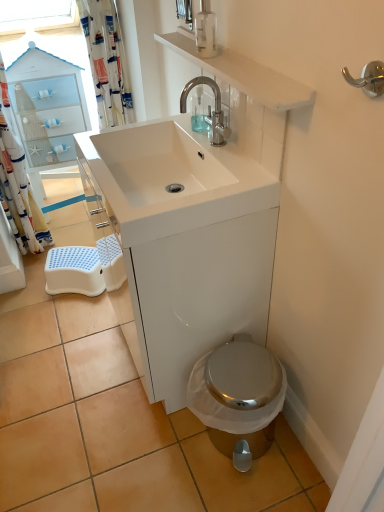
Question: Is there a large distance between transparent plastic soap dispenser at center, the second soap dispenser viewed from the front, and white fabric shower curtain at left, the 2th shower curtain viewed from the right?

Choices:
 (A) no
 (B) yes

Answer: (B)

Question: Does transparent plastic soap dispenser at center, the second soap dispenser viewed from the front, have a greater height compared to white fabric shower curtain at left, the 2th shower curtain viewed from the right?

Choices:
 (A) yes
 (B) no

Answer: (B)

Question: Is white fabric shower curtain at left, which is counted as the 1th shower curtain, starting from the left, located within transparent plastic soap dispenser at center, the first soap dispenser when ordered from back to front?

Choices:
 (A) no
 (B) yes

Answer: (A)

Question: Considering the relative sizes of transparent plastic soap dispenser at center, placed as the 2th soap dispenser when sorted from top to bottom, and white fabric shower curtain at left, which is counted as the 1th shower curtain, starting from the left, in the image provided, is transparent plastic soap dispenser at center, placed as the 2th soap dispenser when sorted from top to bottom, wider than white fabric shower curtain at left, which is counted as the 1th shower curtain, starting from the left,?

Choices:
 (A) yes
 (B) no

Answer: (B)

Question: Does transparent plastic soap dispenser at center, placed as the 2th soap dispenser when sorted from top to bottom, appear on the right side of white fabric shower curtain at left, the 2th shower curtain viewed from the right?

Choices:
 (A) yes
 (B) no

Answer: (A)

Question: Is point (203, 40) positioned closer to the camera than point (26, 220)?

Choices:
 (A) closer
 (B) farther

Answer: (A)

Question: In terms of width, does clear glass soap dispenser at upper center, the 1th soap dispenser in the top-to-bottom sequence, look wider or thinner when compared to white fabric shower curtain at left, which is counted as the 1th shower curtain, starting from the left?

Choices:
 (A) wide
 (B) thin

Answer: (B)

Question: Considering the positions of clear glass soap dispenser at upper center, the first soap dispenser from the front, and white fabric shower curtain at left, the 2th shower curtain viewed from the right, in the image, is clear glass soap dispenser at upper center, the first soap dispenser from the front, taller or shorter than white fabric shower curtain at left, the 2th shower curtain viewed from the right,?

Choices:
 (A) short
 (B) tall

Answer: (A)

Question: From a real-world perspective, is clear glass soap dispenser at upper center, the first soap dispenser from the front, above or below white fabric shower curtain at left, the 2th shower curtain viewed from the right?

Choices:
 (A) below
 (B) above

Answer: (B)

Question: Would you say white fabric shower curtain at upper left, the 1th shower curtain positioned from the right, is to the left or to the right of white glossy sink at center in the picture?

Choices:
 (A) left
 (B) right

Answer: (A)

Question: From the image's perspective, is white fabric shower curtain at upper left, arranged as the 2th shower curtain when viewed from the left, positioned above or below white glossy sink at center?

Choices:
 (A) below
 (B) above

Answer: (B)

Question: Considering the positions of white fabric shower curtain at upper left, arranged as the 2th shower curtain when viewed from the left, and white glossy sink at center in the image, is white fabric shower curtain at upper left, arranged as the 2th shower curtain when viewed from the left, bigger or smaller than white glossy sink at center?

Choices:
 (A) big
 (B) small

Answer: (B)

Question: Looking at their shapes, would you say white fabric shower curtain at upper left, the 1th shower curtain positioned from the right, is wider or thinner than white glossy sink at center?

Choices:
 (A) thin
 (B) wide

Answer: (A)

Question: From the image's perspective, relative to clear glass soap dispenser at upper center, which appears as the second soap dispenser when ordered from the bottom, is white glossy sink at upper center above or below?

Choices:
 (A) above
 (B) below

Answer: (B)

Question: In the image, is white glossy sink at upper center positioned in front of or behind clear glass soap dispenser at upper center, the first soap dispenser from the front?

Choices:
 (A) behind
 (B) front

Answer: (B)